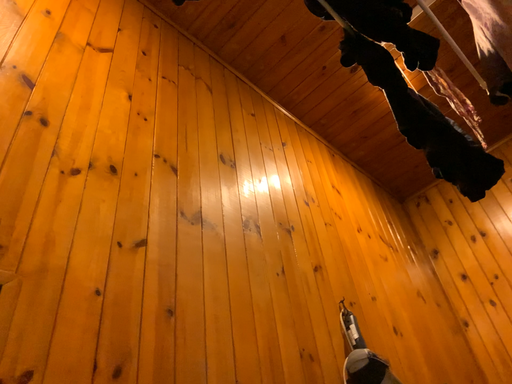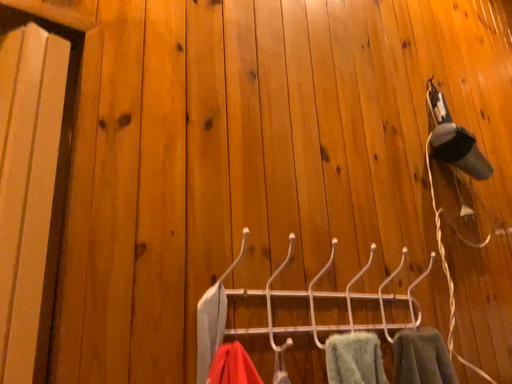
Question: How did the camera likely rotate when shooting the video?

Choices:
 (A) rotated upward
 (B) rotated downward

Answer: (B)